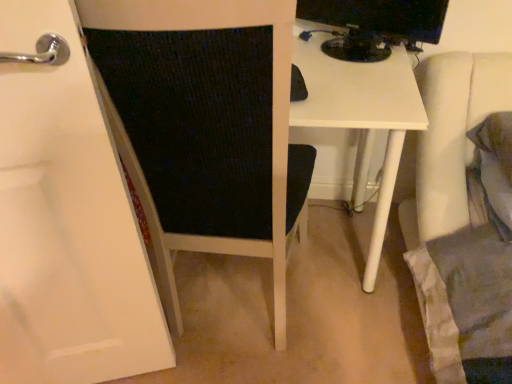
The image size is (512, 384). Identify the location of free spot in front of black glossy monitor at upper right. (358, 86).